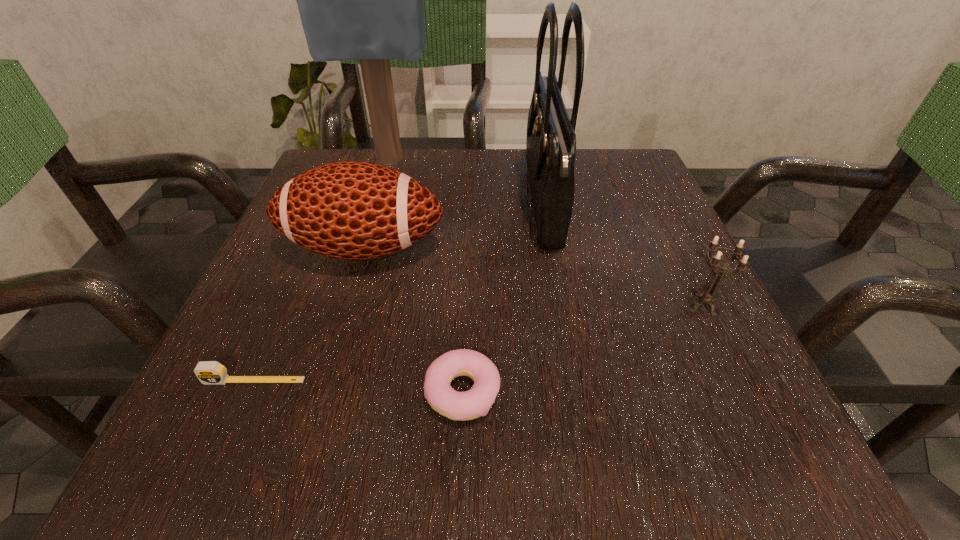
The width and height of the screenshot is (960, 540). I want to click on vacant space located with an open clasp on the front of the fifth object from left to right, so click(341, 203).

Locate an element on the screen. vacant space located on the back of the third tallest object is located at coordinates (391, 155).

Locate an element on the screen. The image size is (960, 540). free location located on the left of the fourth tallest object is located at coordinates (452, 305).

Where is `free space located 0.130m on the left of the doughnut`? free space located 0.130m on the left of the doughnut is located at coordinates (329, 393).

Where is `free region located at the front of the tape measure with the tape extended`? free region located at the front of the tape measure with the tape extended is located at coordinates (x=234, y=427).

Find the location of a particular element. The image size is (960, 540). mallet positioned at the far edge is located at coordinates (363, 0).

Find the location of a particular element. Image resolution: width=960 pixels, height=540 pixels. handbag that is positioned at the far edge is located at coordinates (551, 140).

Identify the location of object at the near edge. This screenshot has width=960, height=540. click(468, 405).

Locate an element on the screen. mallet that is at the left edge is located at coordinates (363, 0).

This screenshot has width=960, height=540. What are the coordinates of `football that is positioned at the left edge` in the screenshot? It's located at (352, 210).